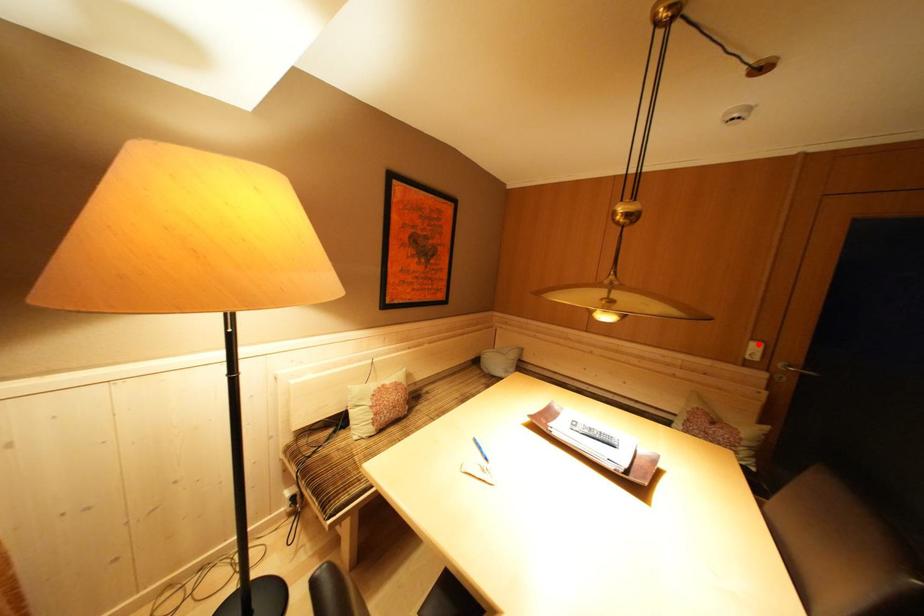
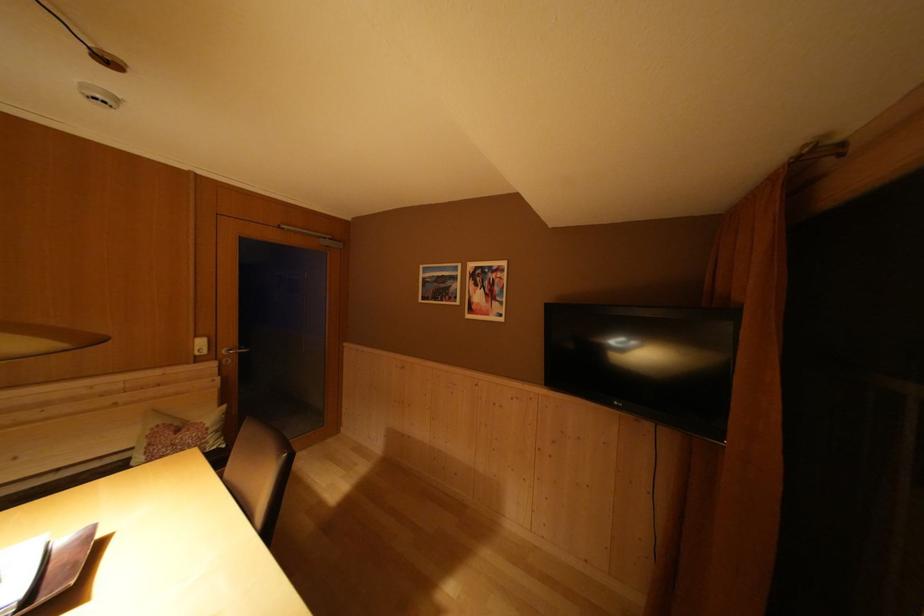
In the second image, find the point that corresponds to the highlighted location in the first image.

(203, 342)